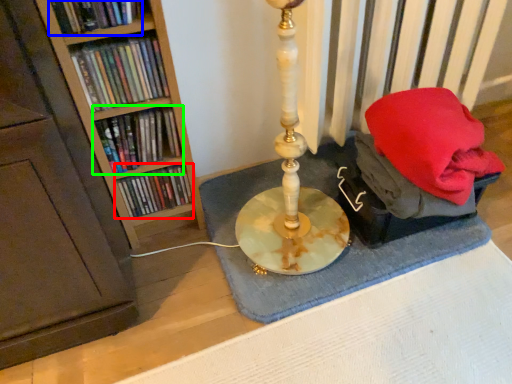
Question: Based on their relative distances, which object is nearer to book (highlighted by a red box)? Choose from book (highlighted by a blue box) and book (highlighted by a green box).

Choices:
 (A) book
 (B) book

Answer: (B)